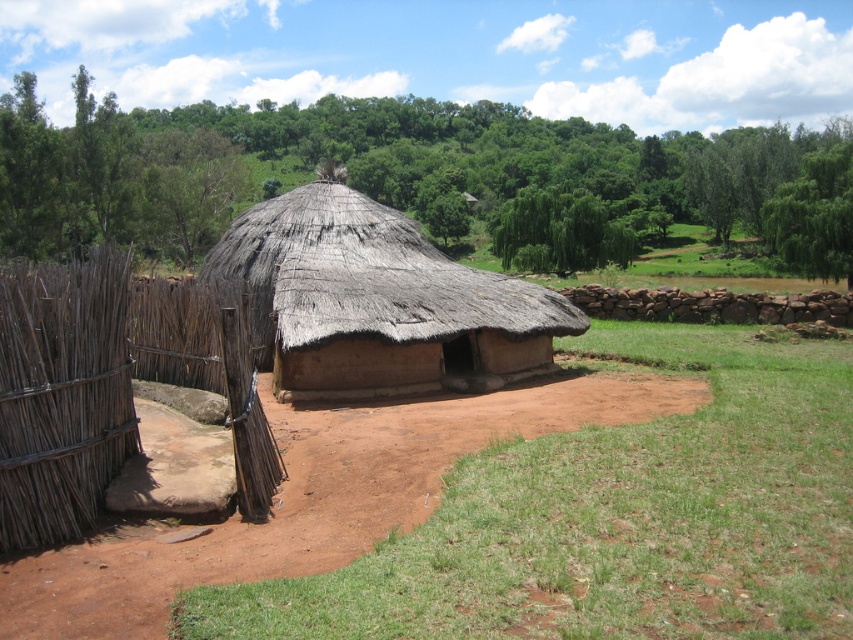
Question: Among these objects, which one is farthest from the camera?

Choices:
 (A) thatched brown hut at center
 (B) green grass at center
 (C) brown woven fence at left

Answer: (A)

Question: Can you confirm if green grass at center is wider than thatched brown hut at center?

Choices:
 (A) yes
 (B) no

Answer: (A)

Question: Considering the real-world distances, which object is closest to the green grass at center?

Choices:
 (A) thatched brown hut at center
 (B) brown woven fence at left

Answer: (B)

Question: Is brown woven fence at left to the left of thatched brown hut at center from the viewer's perspective?

Choices:
 (A) no
 (B) yes

Answer: (B)

Question: Which of the following is the closest to the observer?

Choices:
 (A) thatched brown hut at center
 (B) green grass at center

Answer: (B)

Question: Is the position of brown woven fence at left more distant than that of thatched brown hut at center?

Choices:
 (A) no
 (B) yes

Answer: (A)